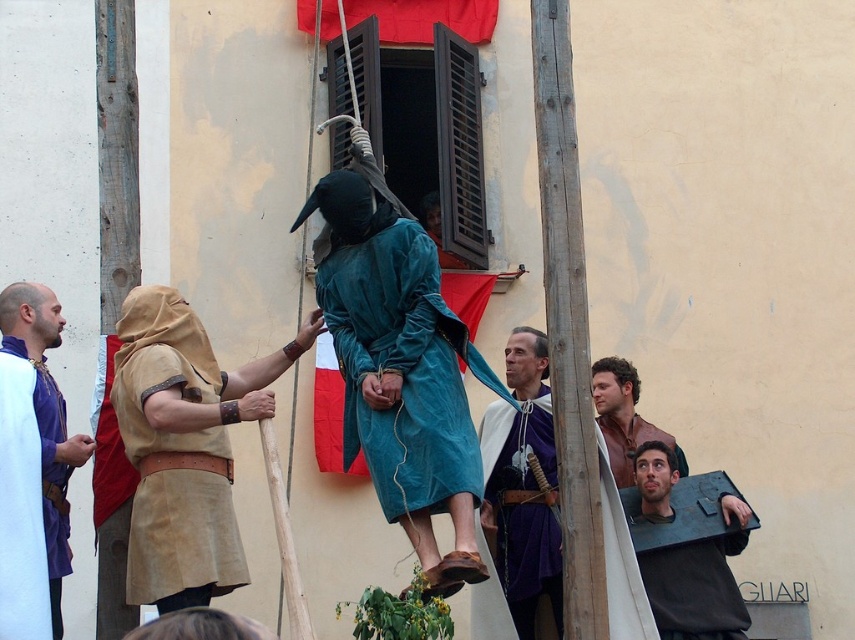
In the scene shown: Is matte purple tunic at left above brown leather jacket at upper right?

Incorrect, matte purple tunic at left is not positioned above brown leather jacket at upper right.

Is matte purple tunic at left positioned before brown leather jacket at upper right?

Yes, it is.

The height and width of the screenshot is (640, 855). In order to click on matte purple tunic at left in this screenshot , I will do `click(45, 420)`.

You are a GUI agent. You are given a task and a screenshot of the screen. Output one action in this format:
    pyautogui.click(x=<x>, y=<y>)
    Task: Click on the matte purple tunic at left
    
    Given the screenshot: What is the action you would take?
    pyautogui.click(x=45, y=420)

How far apart are matte blue robe at center and dark gray leather shield at lower right?

matte blue robe at center and dark gray leather shield at lower right are 4.67 meters apart from each other.

What do you see at coordinates (517, 499) in the screenshot? This screenshot has width=855, height=640. I see `matte blue robe at center` at bounding box center [517, 499].

Where is `matte blue robe at center`? Image resolution: width=855 pixels, height=640 pixels. matte blue robe at center is located at coordinates (517, 499).

Which is in front, point (222, 508) or point (62, 627)?

Positioned in front is point (222, 508).

Who is lower down, tan leather tunic at left or matte purple tunic at left?

matte purple tunic at left

Describe the element at coordinates (175, 454) in the screenshot. Image resolution: width=855 pixels, height=640 pixels. I see `tan leather tunic at left` at that location.

At what (x,y) coordinates should I click in order to perform the action: click on tan leather tunic at left. Please return your answer as a coordinate pair (x, y). Looking at the image, I should click on (175, 454).